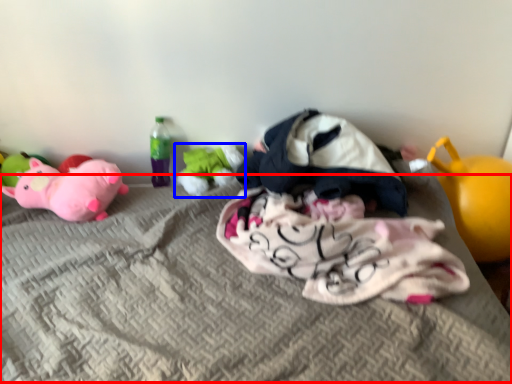
Question: Among these objects, which one is nearest to the camera, mattress (highlighted by a red box) or toy (highlighted by a blue box)?

Choices:
 (A) mattress
 (B) toy

Answer: (A)